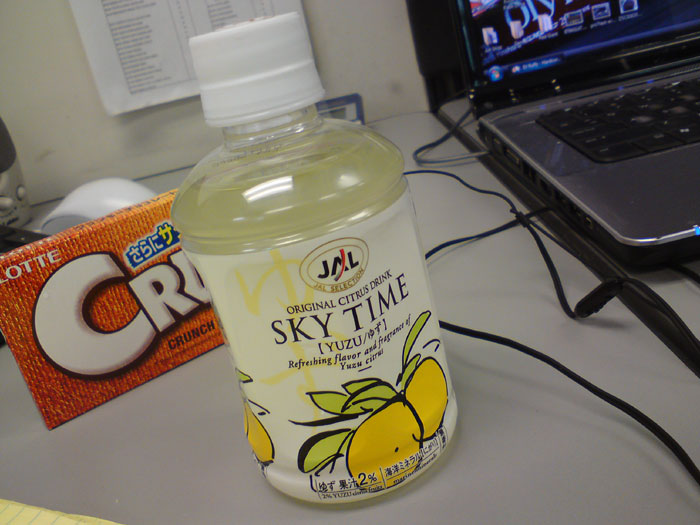
The image size is (700, 525). I want to click on cords, so click(x=547, y=261), click(x=451, y=242).